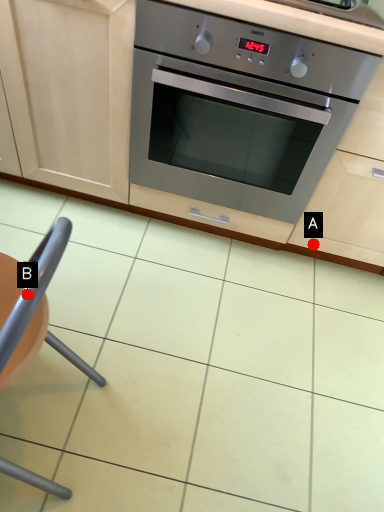
Question: Two points are circled on the image, labeled by A and B beside each circle. Which point is farther from the camera taking this photo?

Choices:
 (A) A is further
 (B) B is further

Answer: (A)